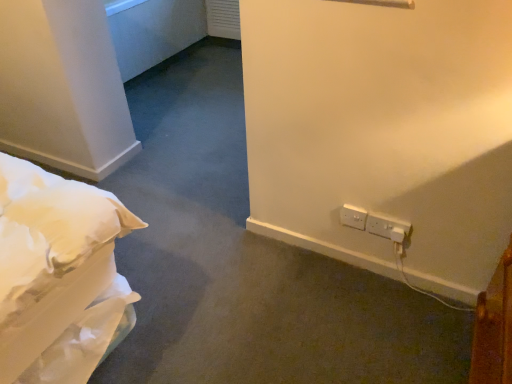
Image resolution: width=512 pixels, height=384 pixels. What do you see at coordinates (353, 217) in the screenshot? I see `white plastic electric outlet at lower right, which is the first electric outlet from left to right` at bounding box center [353, 217].

This screenshot has width=512, height=384. Identify the location of white plastic electric outlet at lower right, the second electric outlet positioned from the right. (353, 217).

The width and height of the screenshot is (512, 384). Describe the element at coordinates (388, 228) in the screenshot. I see `white plastic electrical outlet at lower right, the first electric outlet positioned from the right` at that location.

The image size is (512, 384). I want to click on white plastic electrical outlet at lower right, the 2th electric outlet in the left-to-right sequence, so click(x=388, y=228).

At what (x,y) coordinates should I click in order to perform the action: click on white plastic electric outlet at lower right, the second electric outlet positioned from the right. Please return your answer as a coordinate pair (x, y). This screenshot has height=384, width=512. Looking at the image, I should click on (353, 217).

Which is more to the right, white plastic electrical outlet at lower right, the 2th electric outlet in the left-to-right sequence, or white plastic electric outlet at lower right, the second electric outlet positioned from the right?

Positioned to the right is white plastic electrical outlet at lower right, the 2th electric outlet in the left-to-right sequence.

Is white plastic electrical outlet at lower right, the 2th electric outlet in the left-to-right sequence, positioned behind white plastic electric outlet at lower right, the second electric outlet positioned from the right?

Result: No, it is in front of white plastic electric outlet at lower right, the second electric outlet positioned from the right.

Which point is more distant from viewer, (402, 234) or (357, 222)?

Point (357, 222)

From the image's perspective, is white plastic electrical outlet at lower right, the 2th electric outlet in the left-to-right sequence, located above white plastic electric outlet at lower right, which is the first electric outlet from left to right?

No, from the image's perspective, white plastic electrical outlet at lower right, the 2th electric outlet in the left-to-right sequence, is not above white plastic electric outlet at lower right, which is the first electric outlet from left to right.

From a real-world perspective, relative to white plastic electric outlet at lower right, the second electric outlet positioned from the right, is white plastic electrical outlet at lower right, the 2th electric outlet in the left-to-right sequence, vertically above or below?

white plastic electrical outlet at lower right, the 2th electric outlet in the left-to-right sequence, is below white plastic electric outlet at lower right, the second electric outlet positioned from the right.

Considering the sizes of objects white plastic electrical outlet at lower right, the first electric outlet positioned from the right, and white plastic electric outlet at lower right, the second electric outlet positioned from the right, in the image provided, who is thinner, white plastic electrical outlet at lower right, the first electric outlet positioned from the right, or white plastic electric outlet at lower right, the second electric outlet positioned from the right,?

white plastic electric outlet at lower right, the second electric outlet positioned from the right.

Looking at this image, between white plastic electrical outlet at lower right, the first electric outlet positioned from the right, and white plastic electric outlet at lower right, which is the first electric outlet from left to right, which one has less height?

white plastic electrical outlet at lower right, the first electric outlet positioned from the right.

Does white plastic electrical outlet at lower right, the first electric outlet positioned from the right, have a larger size compared to white plastic electric outlet at lower right, which is the first electric outlet from left to right?

Correct, white plastic electrical outlet at lower right, the first electric outlet positioned from the right, is larger in size than white plastic electric outlet at lower right, which is the first electric outlet from left to right.

Is white plastic electrical outlet at lower right, the first electric outlet positioned from the right, completely or partially outside of white plastic electric outlet at lower right, which is the first electric outlet from left to right?

Yes.

Does white plastic electrical outlet at lower right, the 2th electric outlet in the left-to-right sequence, touch white plastic electric outlet at lower right, the second electric outlet positioned from the right?

Yes, white plastic electrical outlet at lower right, the 2th electric outlet in the left-to-right sequence, is next to white plastic electric outlet at lower right, the second electric outlet positioned from the right.

Could you tell me if white plastic electrical outlet at lower right, the 2th electric outlet in the left-to-right sequence, is facing white plastic electric outlet at lower right, the second electric outlet positioned from the right?

No, white plastic electrical outlet at lower right, the 2th electric outlet in the left-to-right sequence, is not turned towards white plastic electric outlet at lower right, the second electric outlet positioned from the right.

Can you tell me how much white plastic electrical outlet at lower right, the first electric outlet positioned from the right, and white plastic electric outlet at lower right, the second electric outlet positioned from the right, differ in facing direction?

0.000318 degrees separate the facing orientations of white plastic electrical outlet at lower right, the first electric outlet positioned from the right, and white plastic electric outlet at lower right, the second electric outlet positioned from the right.

The height and width of the screenshot is (384, 512). In order to click on electric outlet that is above the white plastic electrical outlet at lower right, the 2th electric outlet in the left-to-right sequence (from the image's perspective) in this screenshot , I will do click(x=353, y=217).

Considering the relative positions of white plastic electric outlet at lower right, the second electric outlet positioned from the right, and white plastic electrical outlet at lower right, the 2th electric outlet in the left-to-right sequence, in the image provided, is white plastic electric outlet at lower right, the second electric outlet positioned from the right, to the right of white plastic electrical outlet at lower right, the 2th electric outlet in the left-to-right sequence, from the viewer's perspective?

No, white plastic electric outlet at lower right, the second electric outlet positioned from the right, is not to the right of white plastic electrical outlet at lower right, the 2th electric outlet in the left-to-right sequence.

Does white plastic electric outlet at lower right, the second electric outlet positioned from the right, lie in front of white plastic electrical outlet at lower right, the first electric outlet positioned from the right?

No, the depth of white plastic electric outlet at lower right, the second electric outlet positioned from the right, is greater than that of white plastic electrical outlet at lower right, the first electric outlet positioned from the right.

Considering the points (349, 211) and (375, 224), which point is in front, point (349, 211) or point (375, 224)?

The point (375, 224) is more forward.

From the image's perspective, is white plastic electric outlet at lower right, which is the first electric outlet from left to right, below white plastic electrical outlet at lower right, the 2th electric outlet in the left-to-right sequence?

No.

From a real-world perspective, is white plastic electric outlet at lower right, which is the first electric outlet from left to right, located beneath white plastic electrical outlet at lower right, the first electric outlet positioned from the right?

Actually, white plastic electric outlet at lower right, which is the first electric outlet from left to right, is physically above white plastic electrical outlet at lower right, the first electric outlet positioned from the right, in the real world.

Between white plastic electric outlet at lower right, the second electric outlet positioned from the right, and white plastic electrical outlet at lower right, the 2th electric outlet in the left-to-right sequence, which one has smaller width?

Thinner between the two is white plastic electric outlet at lower right, the second electric outlet positioned from the right.

Considering the relative sizes of white plastic electric outlet at lower right, which is the first electric outlet from left to right, and white plastic electrical outlet at lower right, the first electric outlet positioned from the right, in the image provided, is white plastic electric outlet at lower right, which is the first electric outlet from left to right, taller than white plastic electrical outlet at lower right, the first electric outlet positioned from the right,?

Indeed, white plastic electric outlet at lower right, which is the first electric outlet from left to right, has a greater height compared to white plastic electrical outlet at lower right, the first electric outlet positioned from the right.

Which of these two, white plastic electric outlet at lower right, the second electric outlet positioned from the right, or white plastic electrical outlet at lower right, the 2th electric outlet in the left-to-right sequence, is smaller?

With smaller size is white plastic electric outlet at lower right, the second electric outlet positioned from the right.

Is white plastic electric outlet at lower right, the second electric outlet positioned from the right, inside the boundaries of white plastic electrical outlet at lower right, the 2th electric outlet in the left-to-right sequence, or outside?

white plastic electric outlet at lower right, the second electric outlet positioned from the right, cannot be found inside white plastic electrical outlet at lower right, the 2th electric outlet in the left-to-right sequence.

Is white plastic electric outlet at lower right, which is the first electric outlet from left to right, far from white plastic electrical outlet at lower right, the 2th electric outlet in the left-to-right sequence?

No, white plastic electric outlet at lower right, which is the first electric outlet from left to right, is not far from white plastic electrical outlet at lower right, the 2th electric outlet in the left-to-right sequence.

Is white plastic electric outlet at lower right, the second electric outlet positioned from the right, turned away from white plastic electrical outlet at lower right, the first electric outlet positioned from the right?

No, white plastic electric outlet at lower right, the second electric outlet positioned from the right, is not facing the opposite direction of white plastic electrical outlet at lower right, the first electric outlet positioned from the right.

How distant is white plastic electric outlet at lower right, the second electric outlet positioned from the right, from white plastic electrical outlet at lower right, the first electric outlet positioned from the right?

The distance of white plastic electric outlet at lower right, the second electric outlet positioned from the right, from white plastic electrical outlet at lower right, the first electric outlet positioned from the right, is 2.88 inches.

Where is `electric outlet in front of the white plastic electric outlet at lower right, the second electric outlet positioned from the right`? This screenshot has width=512, height=384. electric outlet in front of the white plastic electric outlet at lower right, the second electric outlet positioned from the right is located at coordinates (388, 228).

Where is `electric outlet on the left of white plastic electrical outlet at lower right, the 2th electric outlet in the left-to-right sequence`? The image size is (512, 384). electric outlet on the left of white plastic electrical outlet at lower right, the 2th electric outlet in the left-to-right sequence is located at coordinates (353, 217).

I want to click on electric outlet behind the white plastic electrical outlet at lower right, the 2th electric outlet in the left-to-right sequence, so click(353, 217).